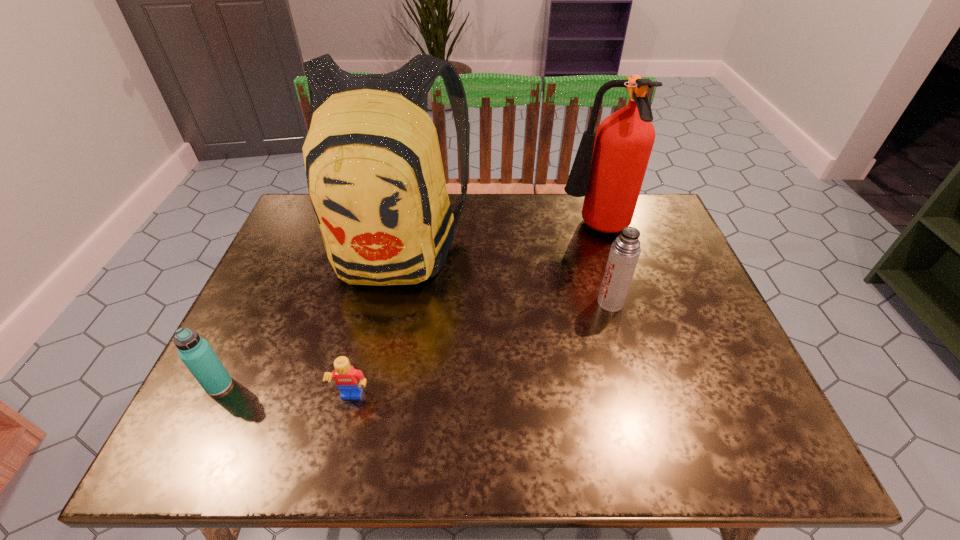
The height and width of the screenshot is (540, 960). In order to click on blank space that satisfies the following two spatial constraints: 1. at the nozzle of the fire extinguisher; 2. on the front-facing side of the backpack in this screenshot , I will do `click(600, 246)`.

Where is `vacant region that satisfies the following two spatial constraints: 1. on the front-facing side of the backpack; 2. on the right side of the right thermos bottle`? This screenshot has height=540, width=960. vacant region that satisfies the following two spatial constraints: 1. on the front-facing side of the backpack; 2. on the right side of the right thermos bottle is located at coordinates (383, 302).